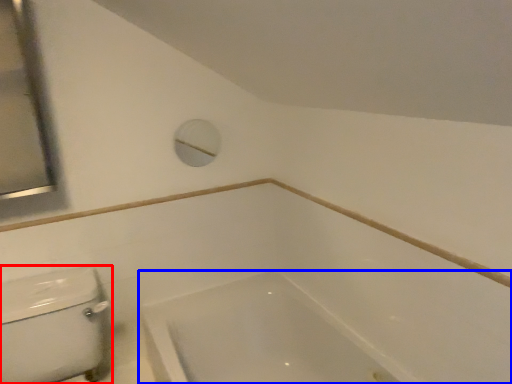
Question: Which of the following is the closest to the observer, porcelain (highlighted by a red box) or bathtub (highlighted by a blue box)?

Choices:
 (A) porcelain
 (B) bathtub

Answer: (A)